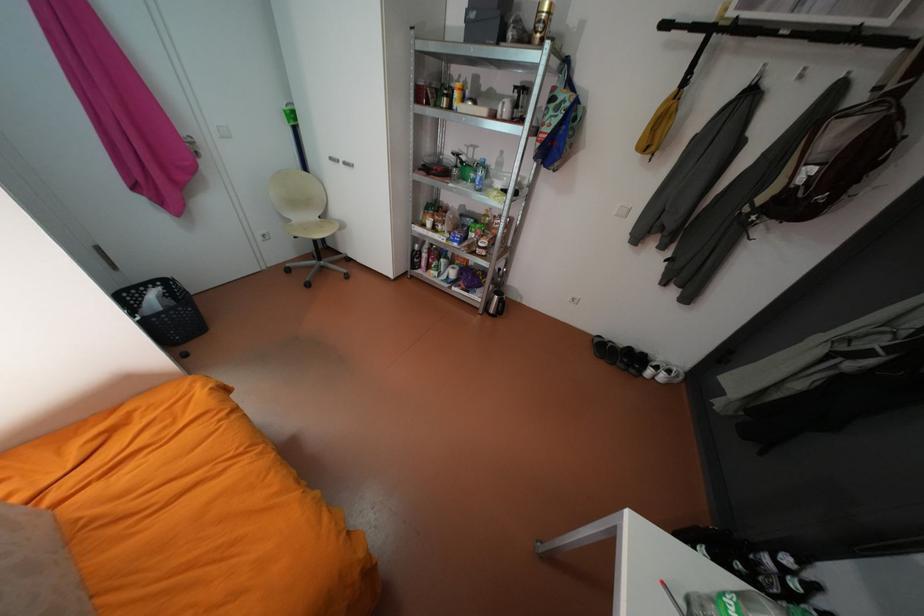
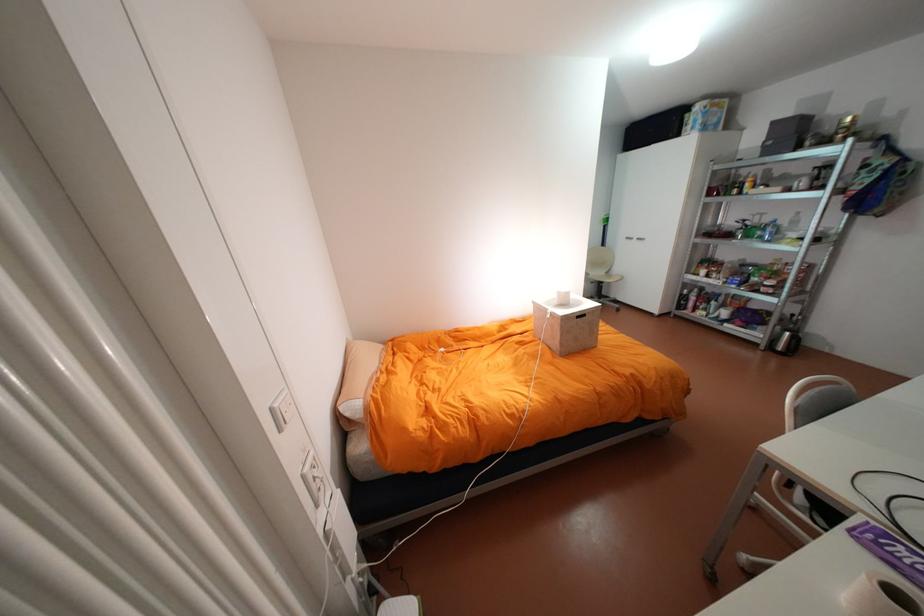
Where in the second image is the point corresponding to [488,155] from the first image?

(775, 219)